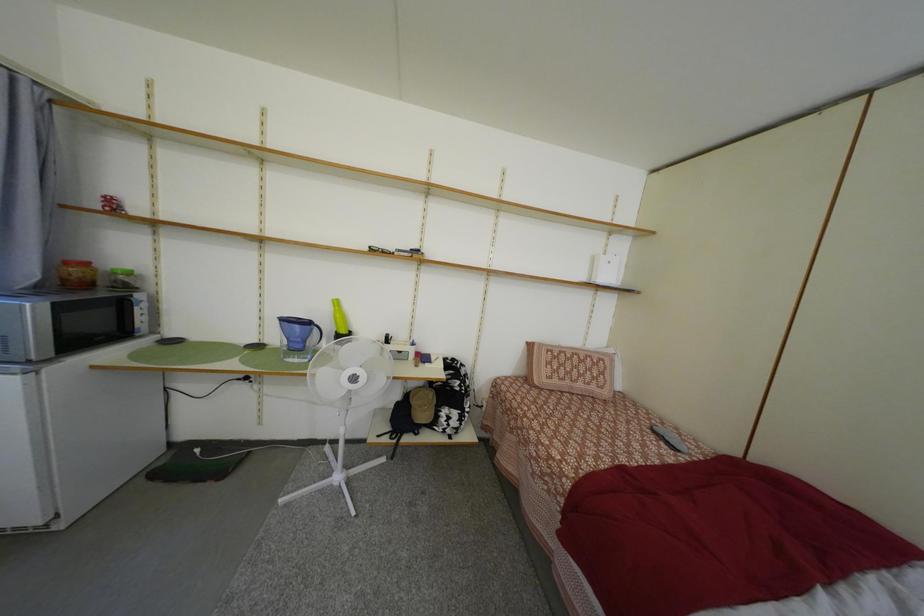
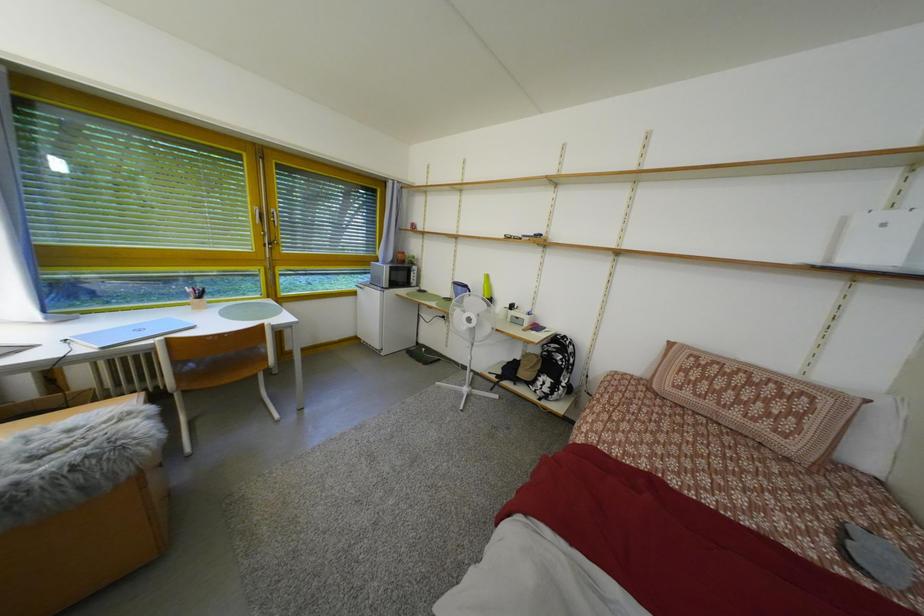
Question: Based on the continuous images, in which direction is the camera rotating? Reply with the corresponding letter.

Choices:
 (A) Left
 (B) Right
 (C) Up
 (D) Down

Answer: (A)